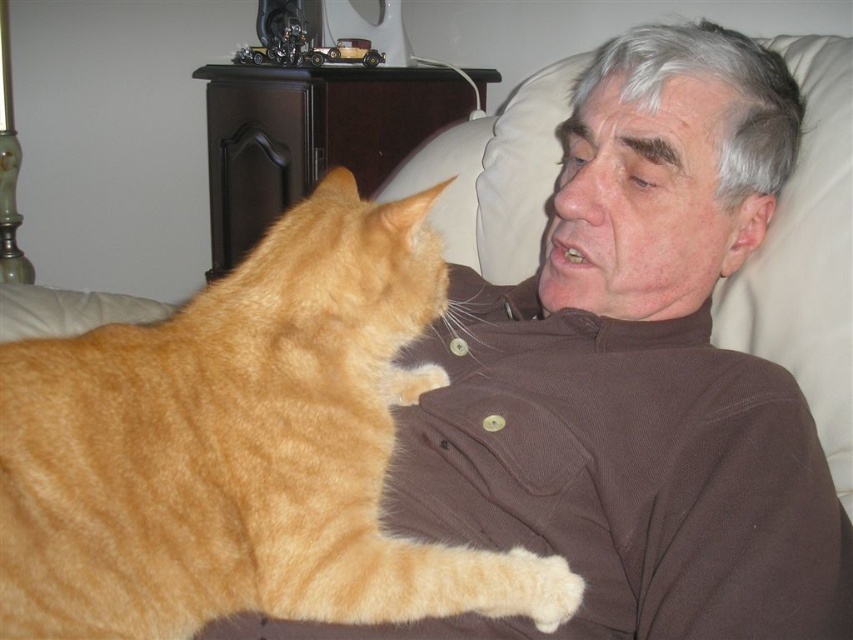
Question: Which object appears farthest from the camera in this image?

Choices:
 (A) brown corduroy shirt at upper right
 (B) orange fur cat at upper left
 (C) white soft pillow at upper right

Answer: (C)

Question: Which point appears farthest from the camera in this image?

Choices:
 (A) (234, 582)
 (B) (770, 326)
 (C) (762, 566)

Answer: (B)

Question: Can you confirm if orange fur cat at upper left is thinner than white soft pillow at upper right?

Choices:
 (A) yes
 (B) no

Answer: (B)

Question: Which of the following is the farthest from the observer?

Choices:
 (A) (555, 100)
 (B) (653, 392)

Answer: (A)

Question: Can you confirm if orange fur cat at upper left is smaller than white soft pillow at upper right?

Choices:
 (A) yes
 (B) no

Answer: (B)

Question: Considering the relative positions of orange fur cat at upper left and white soft pillow at upper right in the image provided, where is orange fur cat at upper left located with respect to white soft pillow at upper right?

Choices:
 (A) below
 (B) above

Answer: (A)